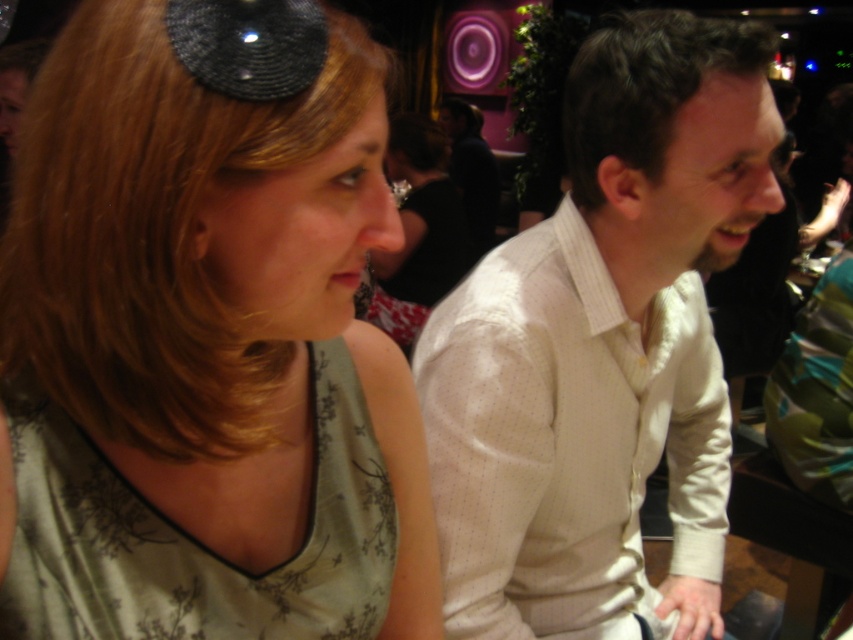
You are a fashion designer observing the image. You need to decide which item would require less fabric to produce between the white textured shirt at right and the matte black hair at center. Which one would it be?

The white textured shirt at right has a smaller size compared to matte black hair at center, so it would require less fabric to produce.

You are a photographer trying to capture a candid shot of two people sitting at a table. The two people are represented by the point at point (152, 502). You need to ensure that both subjects are fully visible in the frame. If your camera has a minimum focus distance of 20 inches, will you be able to capture both people clearly?

The two people represented by the point at point (152, 502) are 20.54 inches apart. Since the minimum focus distance is 20 inches, the camera can focus on both subjects as the distance between them is slightly beyond the minimum requirement.